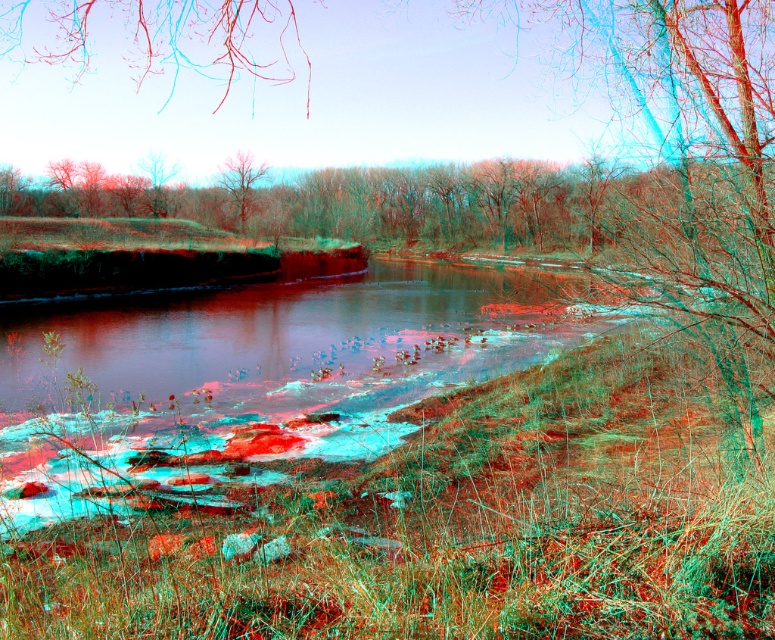
Question: Is green matte tree at center to the left of smooth bark tree at center from the viewer's perspective?

Choices:
 (A) yes
 (B) no

Answer: (B)

Question: Which of these objects is positioned closest to the green matte tree at center?

Choices:
 (A) smooth bark tree at center
 (B) smooth bark tree at upper left

Answer: (A)

Question: Which point is closer to the camera?

Choices:
 (A) smooth bark tree at center
 (B) green matte tree at center

Answer: (B)

Question: Which point is closer to the camera?

Choices:
 (A) pyautogui.click(x=259, y=170)
 (B) pyautogui.click(x=178, y=168)

Answer: (B)

Question: Is green matte tree at center wider than smooth bark tree at center?

Choices:
 (A) yes
 (B) no

Answer: (A)

Question: Is green matte tree at center wider than smooth bark tree at center?

Choices:
 (A) yes
 (B) no

Answer: (A)